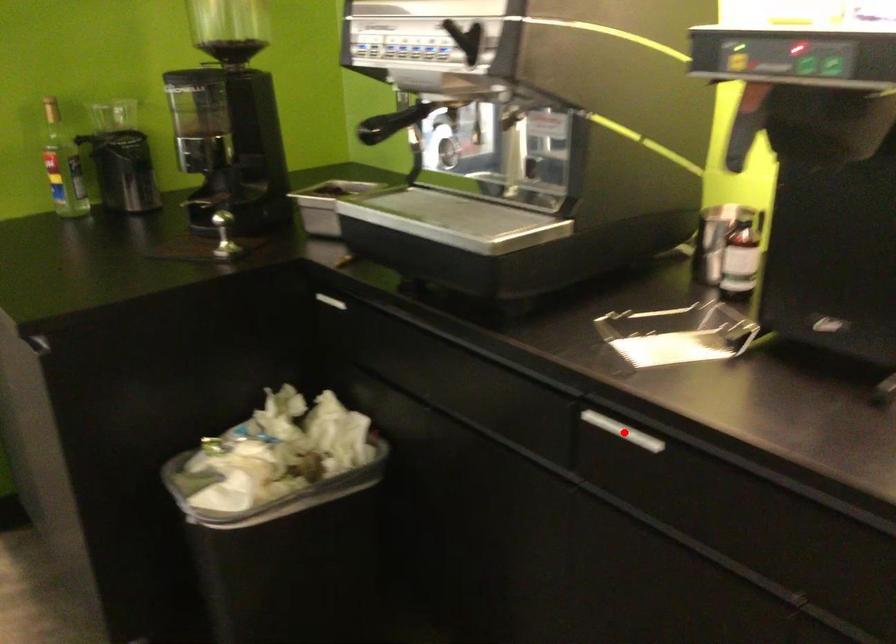
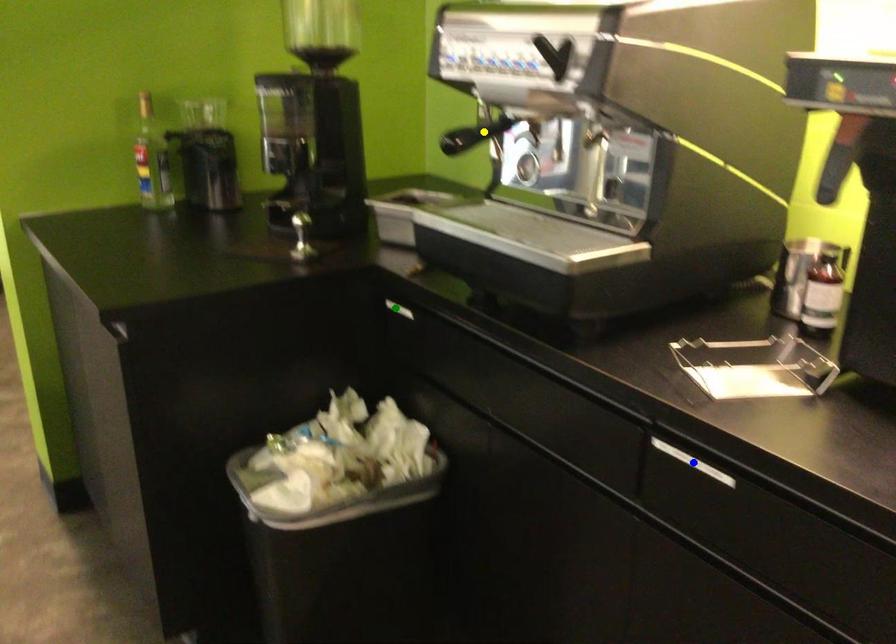
Question: I am providing you with two images of the same scene from different viewpoints. A red point is marked on the first image. You are given multiple points on the second image. Which point in image 2 is actually the same real-world point as the red point in image 1?

Choices:
 (A) yellow point
 (B) green point
 (C) blue point

Answer: (C)